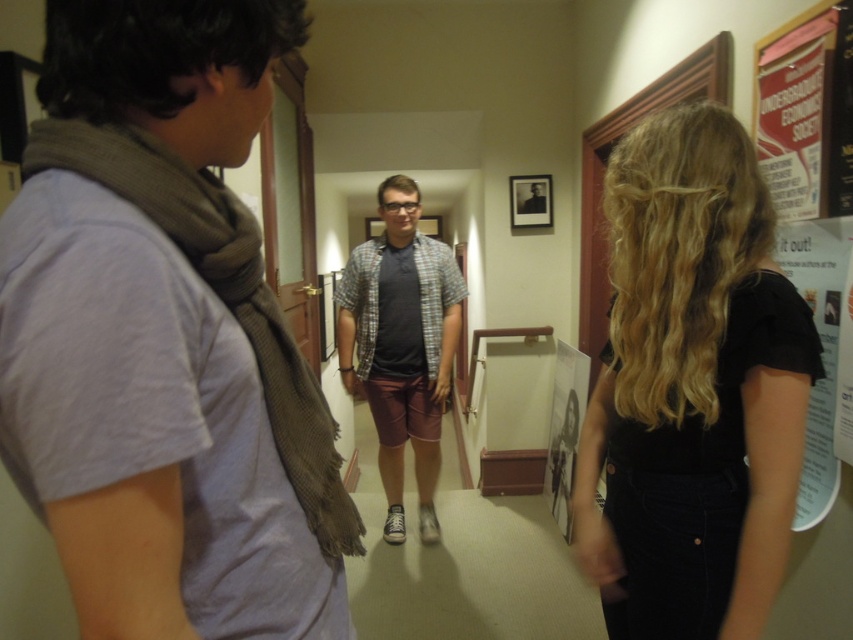
Measure the distance between plaid shirt at center and white paper poster at center.

plaid shirt at center and white paper poster at center are 28.29 inches apart from each other.

Image resolution: width=853 pixels, height=640 pixels. I want to click on plaid shirt at center, so click(401, 346).

What do you see at coordinates (401, 346) in the screenshot? This screenshot has height=640, width=853. I see `plaid shirt at center` at bounding box center [401, 346].

This screenshot has height=640, width=853. What are the coordinates of `plaid shirt at center` in the screenshot? It's located at (401, 346).

Who is shorter, plaid shirt at center or white paper at right?

white paper at right is shorter.

Is point (405, 385) closer to viewer compared to point (838, 275)?

No, (405, 385) is further to viewer.

Identify the location of plaid shirt at center. The image size is (853, 640). (401, 346).

Does black velvet shirt at center have a greater height compared to white paper poster at center?

Yes.

Between black velvet shirt at center and white paper poster at center, which one appears on the left side from the viewer's perspective?

black velvet shirt at center

This screenshot has width=853, height=640. What do you see at coordinates (693, 388) in the screenshot?
I see `black velvet shirt at center` at bounding box center [693, 388].

Identify the location of black velvet shirt at center. The height and width of the screenshot is (640, 853). (693, 388).